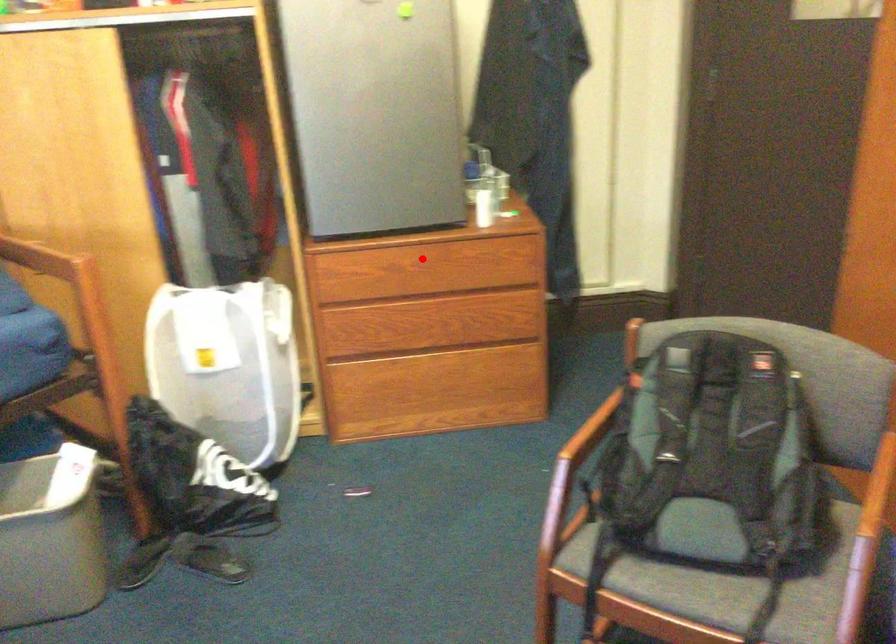
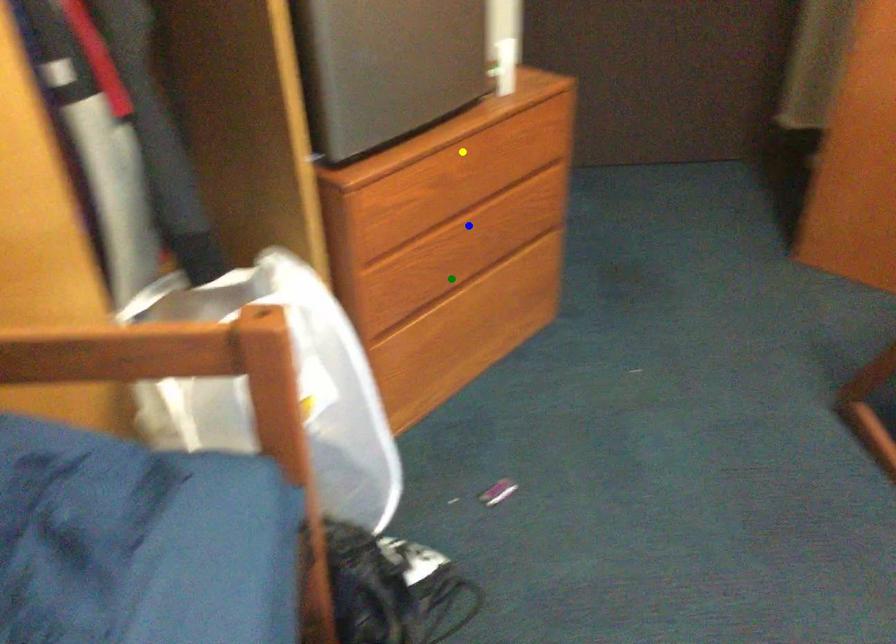
Question: I am providing you with two images of the same scene from different viewpoints. A red point is marked on the first image. You are given multiple points on the second image. Which point in image 2 is actually the same real-world point as the red point in image 1?

Choices:
 (A) yellow point
 (B) green point
 (C) blue point

Answer: (A)